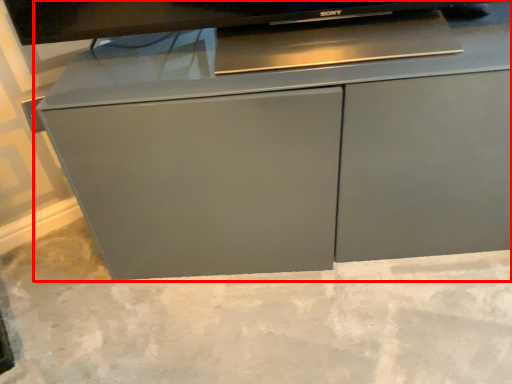
Question: From the image's perspective, considering the relative positions of cabinetry (annotated by the red box) and concrete in the image provided, where is cabinetry (annotated by the red box) located with respect to the staircase?

Choices:
 (A) above
 (B) below

Answer: (A)